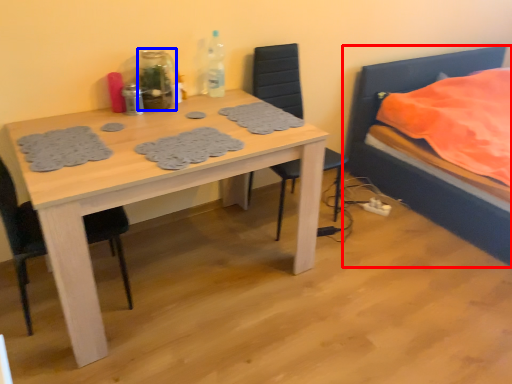
Question: Among these objects, which one is nearest to the camera, bed (highlighted by a red box) or bottle (highlighted by a blue box)?

Choices:
 (A) bed
 (B) bottle

Answer: (A)